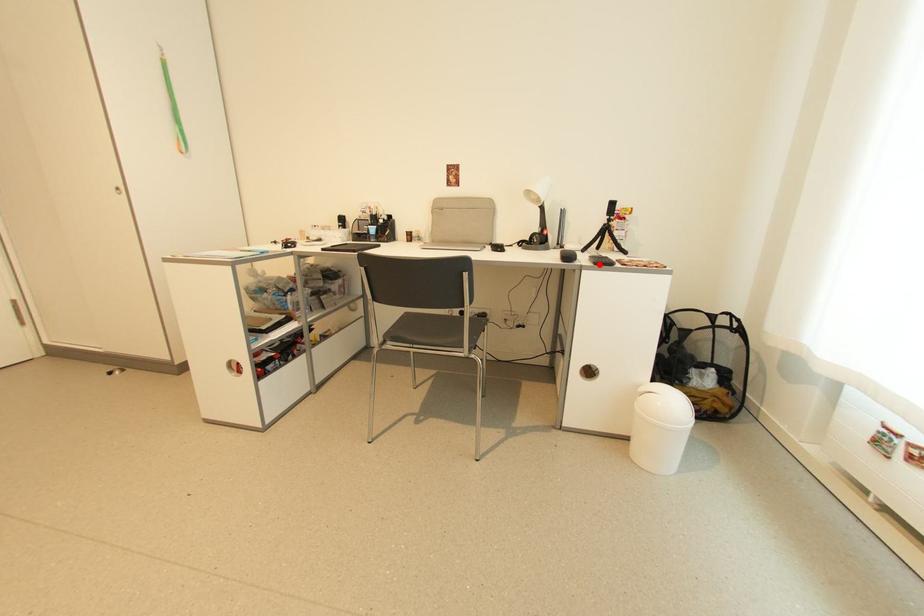
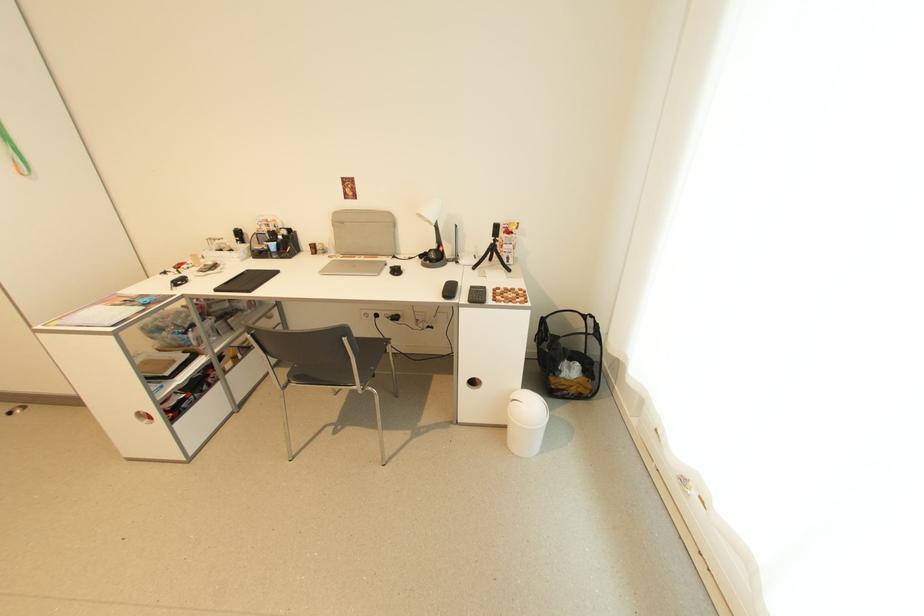
Find the pixel in the second image that matches the highlighted location in the first image.

(473, 302)